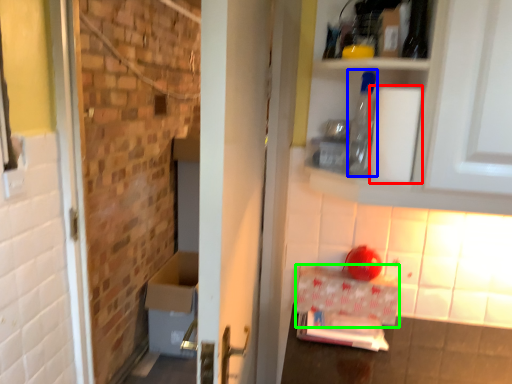
Question: Estimate the real-world distances between objects in this image. Which object is farther from toilet paper (highlighted by a red box), bottle (highlighted by a blue box) or cardboard box (highlighted by a green box)?

Choices:
 (A) bottle
 (B) cardboard box

Answer: (B)